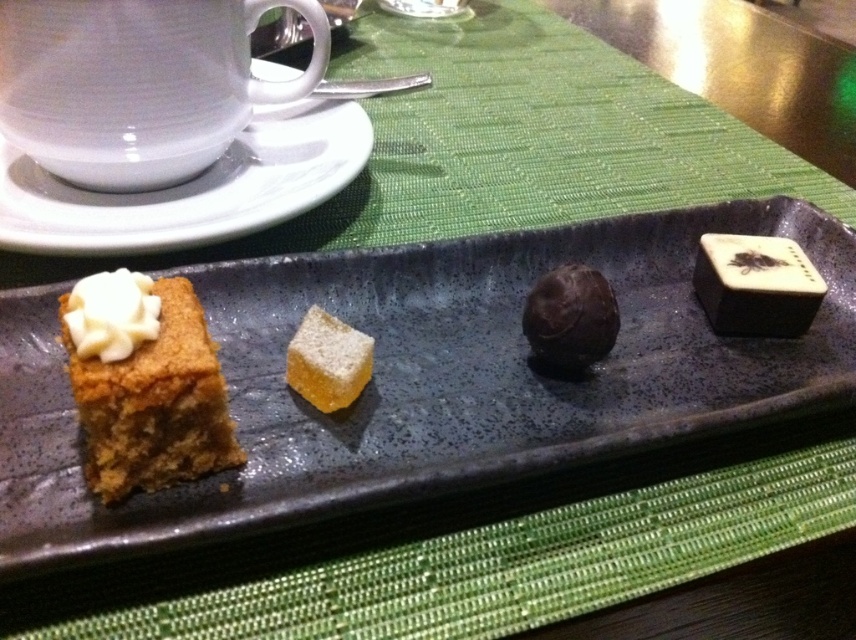
What do you see at coordinates (153, 392) in the screenshot? Image resolution: width=856 pixels, height=640 pixels. I see `golden brown cake at lower left` at bounding box center [153, 392].

Does point (158, 388) lie in front of point (568, 371)?

Yes.

The height and width of the screenshot is (640, 856). I want to click on golden brown cake at lower left, so click(153, 392).

Who is higher up, white ceramic saucer at upper left or golden brown cake at lower left?

white ceramic saucer at upper left

Does white ceramic saucer at upper left have a greater height compared to golden brown cake at lower left?

Yes, white ceramic saucer at upper left is taller than golden brown cake at lower left.

What do you see at coordinates (192, 188) in the screenshot?
I see `white ceramic saucer at upper left` at bounding box center [192, 188].

Image resolution: width=856 pixels, height=640 pixels. Identify the location of white ceramic saucer at upper left. (192, 188).

Which is behind, point (105, 483) or point (305, 328)?

The point (305, 328) is more distant.

What are the coordinates of `golden brown cake at lower left` in the screenshot? It's located at (153, 392).

This screenshot has height=640, width=856. I want to click on golden brown cake at lower left, so click(153, 392).